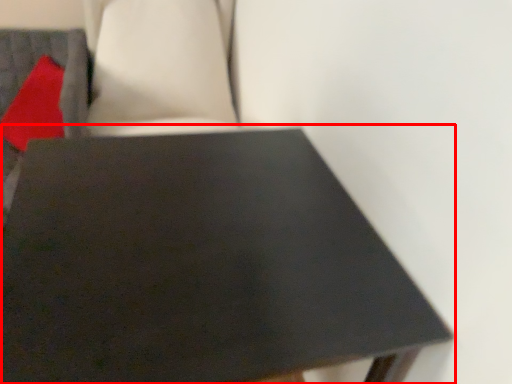
Question: Considering the relative positions of table (annotated by the red box) and pillow in the image provided, where is table (annotated by the red box) located with respect to the staircase?

Choices:
 (A) right
 (B) left

Answer: (A)